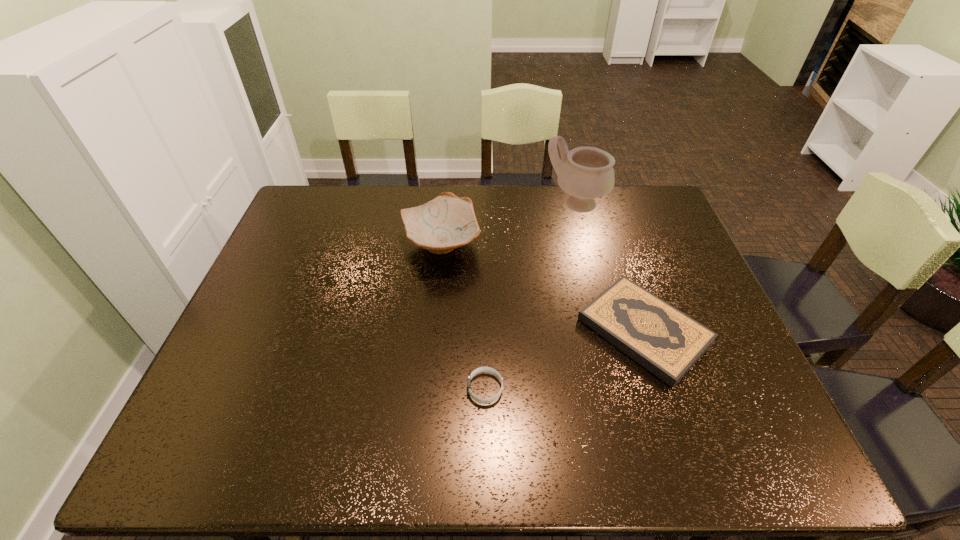
You are a GUI agent. You are given a task and a screenshot of the screen. Output one action in this format:
    pyautogui.click(x=<x>, y=<y>)
    Task: Click on the taller pottery
    This screenshot has width=960, height=540.
    Given the screenshot: What is the action you would take?
    pyautogui.click(x=585, y=173)

Identify the location of the right pottery. The width and height of the screenshot is (960, 540). (585, 173).

Where is `the shorter pottery`? The image size is (960, 540). the shorter pottery is located at coordinates (447, 222).

Locate an element on the screen. the second tallest object is located at coordinates (447, 222).

Image resolution: width=960 pixels, height=540 pixels. Find the location of `hardback book`. hardback book is located at coordinates (667, 342).

You are a GUI agent. You are given a task and a screenshot of the screen. Output one action in this format:
    pyautogui.click(x=<x>, y=<y>)
    Task: Click on the wristband
    This screenshot has height=540, width=960.
    Given the screenshot: What is the action you would take?
    pyautogui.click(x=482, y=369)

The width and height of the screenshot is (960, 540). I want to click on free space located 0.200m on the left of the taller pottery, so click(484, 204).

Where is `vacant space located on the left of the shorter pottery`? Image resolution: width=960 pixels, height=540 pixels. vacant space located on the left of the shorter pottery is located at coordinates (349, 244).

Locate an element on the screen. The height and width of the screenshot is (540, 960). vacant region located on the back of the hardback book is located at coordinates (612, 234).

Where is `free space located 0.230m on the outer surface of the wristband`? The width and height of the screenshot is (960, 540). free space located 0.230m on the outer surface of the wristband is located at coordinates (366, 388).